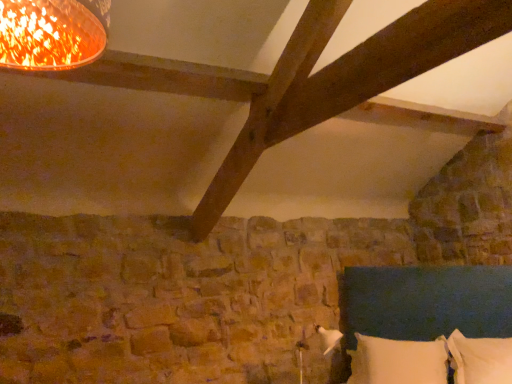
This screenshot has width=512, height=384. What do you see at coordinates (480, 359) in the screenshot? I see `white soft pillow at lower right, which appears as the second pillow when viewed from the left` at bounding box center [480, 359].

The width and height of the screenshot is (512, 384). What are the coordinates of `dark blue fabric bed at lower right` in the screenshot? It's located at (426, 301).

Find the location of a particular element. The height and width of the screenshot is (384, 512). white soft pillow at lower right, the 1th pillow viewed from the right is located at coordinates (480, 359).

Is there a large distance between white soft pillow at lower right, which ranks as the 1th pillow in left-to-right order, and dark blue fabric bed at lower right?

white soft pillow at lower right, which ranks as the 1th pillow in left-to-right order, is actually quite close to dark blue fabric bed at lower right.

In the image, is white soft pillow at lower right, which ranks as the 2th pillow in right-to-left order, on the left side or the right side of dark blue fabric bed at lower right?

white soft pillow at lower right, which ranks as the 2th pillow in right-to-left order, is to the right of dark blue fabric bed at lower right.

Does white soft pillow at lower right, which ranks as the 1th pillow in left-to-right order, turn towards dark blue fabric bed at lower right?

Yes, white soft pillow at lower right, which ranks as the 1th pillow in left-to-right order, is aimed at dark blue fabric bed at lower right.

Is white soft pillow at lower right, which ranks as the 2th pillow in right-to-left order, situated inside dark blue fabric bed at lower right or outside?

white soft pillow at lower right, which ranks as the 2th pillow in right-to-left order, is spatially positioned inside dark blue fabric bed at lower right.

Considering the relative sizes of dark blue fabric bed at lower right and white soft pillow at lower right, the 1th pillow viewed from the right, in the image provided, is dark blue fabric bed at lower right smaller than white soft pillow at lower right, the 1th pillow viewed from the right,?

Actually, dark blue fabric bed at lower right might be larger than white soft pillow at lower right, the 1th pillow viewed from the right.

From the image's perspective, is dark blue fabric bed at lower right below white soft pillow at lower right, the 1th pillow viewed from the right?

No, from the image's perspective, dark blue fabric bed at lower right is not beneath white soft pillow at lower right, the 1th pillow viewed from the right.

Does dark blue fabric bed at lower right appear on the left side of white soft pillow at lower right, the 1th pillow viewed from the right?

Correct, you'll find dark blue fabric bed at lower right to the left of white soft pillow at lower right, the 1th pillow viewed from the right.

How different are the orientations of dark blue fabric bed at lower right and white soft pillow at lower right, the 1th pillow viewed from the right, in degrees?

3.99 degrees separate the facing orientations of dark blue fabric bed at lower right and white soft pillow at lower right, the 1th pillow viewed from the right.

Is point (510, 341) positioned in front of point (396, 358)?

That is True.

Is white soft pillow at lower right, the 1th pillow viewed from the right, positioned with its back to white soft pillow at lower right, which ranks as the 2th pillow in right-to-left order?

white soft pillow at lower right, the 1th pillow viewed from the right, is not turned away from white soft pillow at lower right, which ranks as the 2th pillow in right-to-left order.

Is white soft pillow at lower right, the 1th pillow viewed from the right, surrounding white soft pillow at lower right, which ranks as the 1th pillow in left-to-right order?

No, white soft pillow at lower right, which ranks as the 1th pillow in left-to-right order, is not inside white soft pillow at lower right, the 1th pillow viewed from the right.

Which of these two, white soft pillow at lower right, the 1th pillow viewed from the right, or white soft pillow at lower right, which ranks as the 2th pillow in right-to-left order, is smaller?

Smaller between the two is white soft pillow at lower right, the 1th pillow viewed from the right.

Considering the sizes of objects dark blue fabric bed at lower right and white soft pillow at lower right, which ranks as the 1th pillow in left-to-right order, in the image provided, who is shorter, dark blue fabric bed at lower right or white soft pillow at lower right, which ranks as the 1th pillow in left-to-right order,?

With less height is white soft pillow at lower right, which ranks as the 1th pillow in left-to-right order.

Is dark blue fabric bed at lower right positioned in front of white soft pillow at lower right, which ranks as the 1th pillow in left-to-right order?

Yes, it is in front of white soft pillow at lower right, which ranks as the 1th pillow in left-to-right order.

From the image's perspective, between dark blue fabric bed at lower right and white soft pillow at lower right, which ranks as the 2th pillow in right-to-left order, who is located below?

white soft pillow at lower right, which ranks as the 2th pillow in right-to-left order, from the image's perspective.

Does dark blue fabric bed at lower right have a greater width compared to white soft pillow at lower right, which ranks as the 2th pillow in right-to-left order?

Indeed, dark blue fabric bed at lower right has a greater width compared to white soft pillow at lower right, which ranks as the 2th pillow in right-to-left order.

Can you confirm if white soft pillow at lower right, which ranks as the 2th pillow in right-to-left order, is bigger than white soft pillow at lower right, which appears as the second pillow when viewed from the left?

Yes, white soft pillow at lower right, which ranks as the 2th pillow in right-to-left order, is bigger than white soft pillow at lower right, which appears as the second pillow when viewed from the left.

Which is more to the left, white soft pillow at lower right, which ranks as the 2th pillow in right-to-left order, or white soft pillow at lower right, which appears as the second pillow when viewed from the left?

white soft pillow at lower right, which ranks as the 2th pillow in right-to-left order, is more to the left.

Is white soft pillow at lower right, which ranks as the 1th pillow in left-to-right order, oriented away from white soft pillow at lower right, which appears as the second pillow when viewed from the left?

No, white soft pillow at lower right, which ranks as the 1th pillow in left-to-right order, is not facing away from white soft pillow at lower right, which appears as the second pillow when viewed from the left.

In the scene shown: Considering the sizes of objects white soft pillow at lower right, which appears as the second pillow when viewed from the left, and dark blue fabric bed at lower right in the image provided, who is wider, white soft pillow at lower right, which appears as the second pillow when viewed from the left, or dark blue fabric bed at lower right?

Wider between the two is dark blue fabric bed at lower right.

From a real-world perspective, who is located lower, white soft pillow at lower right, the 1th pillow viewed from the right, or dark blue fabric bed at lower right?

white soft pillow at lower right, the 1th pillow viewed from the right.

Which of these two, white soft pillow at lower right, the 1th pillow viewed from the right, or dark blue fabric bed at lower right, stands shorter?

With less height is white soft pillow at lower right, the 1th pillow viewed from the right.

Based on the photo, which of these two, white soft pillow at lower right, which appears as the second pillow when viewed from the left, or dark blue fabric bed at lower right, is bigger?

Bigger between the two is dark blue fabric bed at lower right.

This screenshot has width=512, height=384. Identify the location of bed on the left of white soft pillow at lower right, which ranks as the 2th pillow in right-to-left order. point(426,301).

This screenshot has width=512, height=384. I want to click on the 1st pillow positioned below the dark blue fabric bed at lower right (from the image's perspective), so click(x=480, y=359).

Based on their spatial positions, is white soft pillow at lower right, the 1th pillow viewed from the right, or white soft pillow at lower right, which ranks as the 2th pillow in right-to-left order, closer to dark blue fabric bed at lower right?

Among the two, white soft pillow at lower right, which ranks as the 2th pillow in right-to-left order, is located nearer to dark blue fabric bed at lower right.

When comparing their distances from white soft pillow at lower right, which appears as the second pillow when viewed from the left, does dark blue fabric bed at lower right or white soft pillow at lower right, which ranks as the 2th pillow in right-to-left order, seem further?

dark blue fabric bed at lower right.

Estimate the real-world distances between objects in this image. Which object is further from white soft pillow at lower right, the 1th pillow viewed from the right, white soft pillow at lower right, which ranks as the 1th pillow in left-to-right order, or dark blue fabric bed at lower right?

dark blue fabric bed at lower right is further to white soft pillow at lower right, the 1th pillow viewed from the right.

When comparing their distances from white soft pillow at lower right, which ranks as the 2th pillow in right-to-left order, does white soft pillow at lower right, the 1th pillow viewed from the right, or dark blue fabric bed at lower right seem further?

dark blue fabric bed at lower right is further to white soft pillow at lower right, which ranks as the 2th pillow in right-to-left order.

From the image, which object appears to be nearer to white soft pillow at lower right, which ranks as the 2th pillow in right-to-left order, dark blue fabric bed at lower right or white soft pillow at lower right, which appears as the second pillow when viewed from the left?

white soft pillow at lower right, which appears as the second pillow when viewed from the left.

From the image, which object appears to be nearer to dark blue fabric bed at lower right, white soft pillow at lower right, which ranks as the 2th pillow in right-to-left order, or white soft pillow at lower right, which appears as the second pillow when viewed from the left?

The object closer to dark blue fabric bed at lower right is white soft pillow at lower right, which ranks as the 2th pillow in right-to-left order.

Find the location of a particular element. The height and width of the screenshot is (384, 512). pillow located between dark blue fabric bed at lower right and white soft pillow at lower right, which appears as the second pillow when viewed from the left, in the left-right direction is located at coordinates (398, 361).